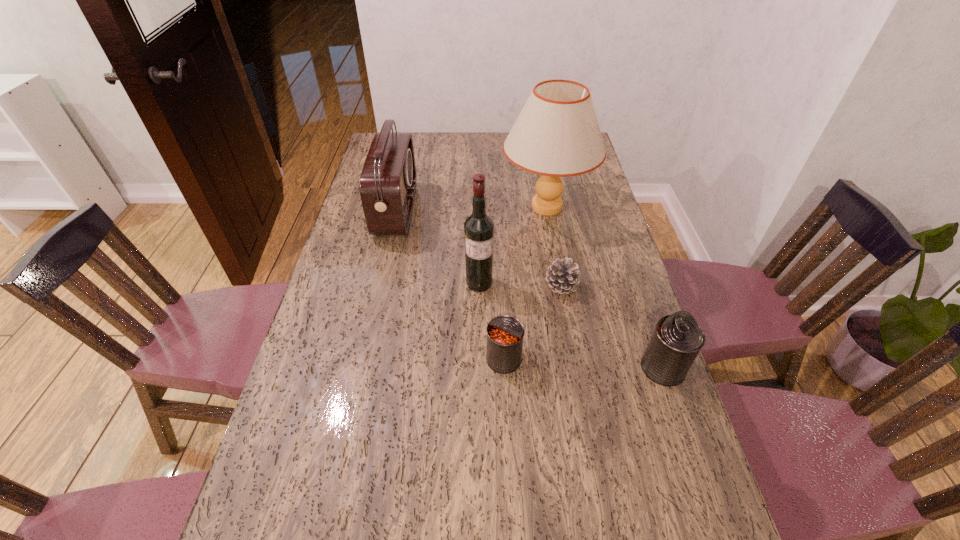
All cans are currently evenly spaced. To continue this pattern, where would you add another can on the left? Please point out a vacant spot. Please provide its 2D coordinates. Your answer should be formatted as a tuple, i.e. [(x, y)], where the tuple contains the x and y coordinates of a point satisfying the conditions above.

[(349, 350)]